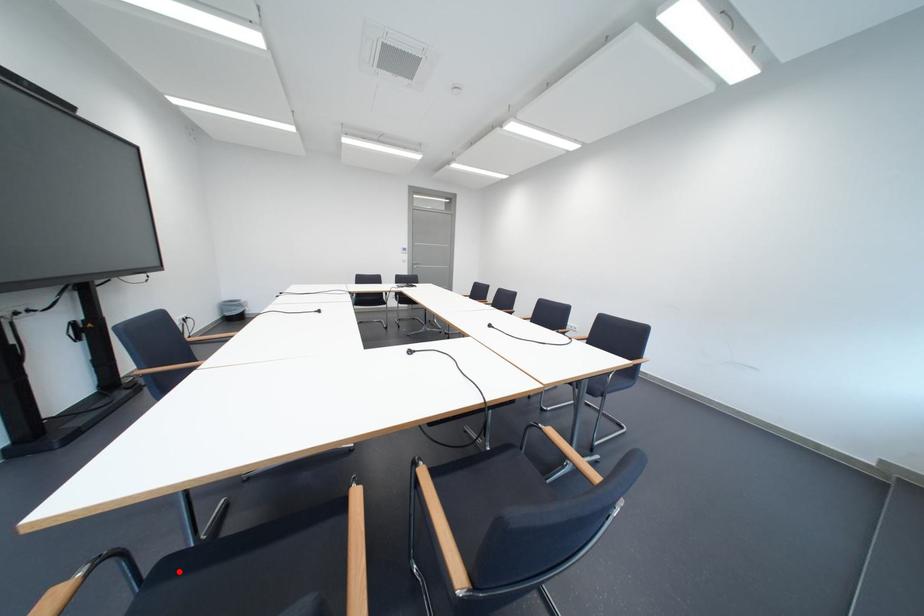
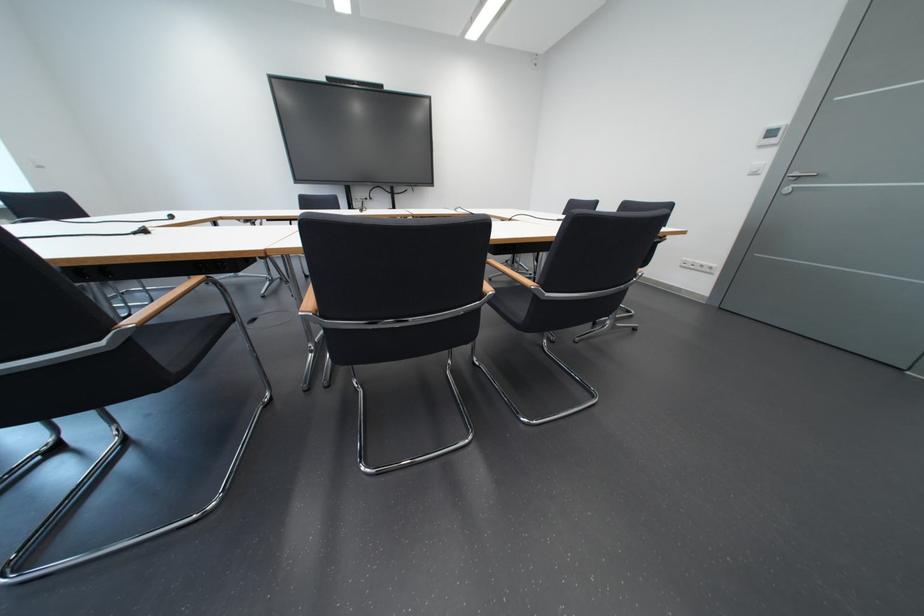
Question: I am providing you with two images of the same scene from different viewpoints. A red point is marked on the first image. Can you still see the location of the red point in image 2?

Choices:
 (A) Yes
 (B) No

Answer: (B)